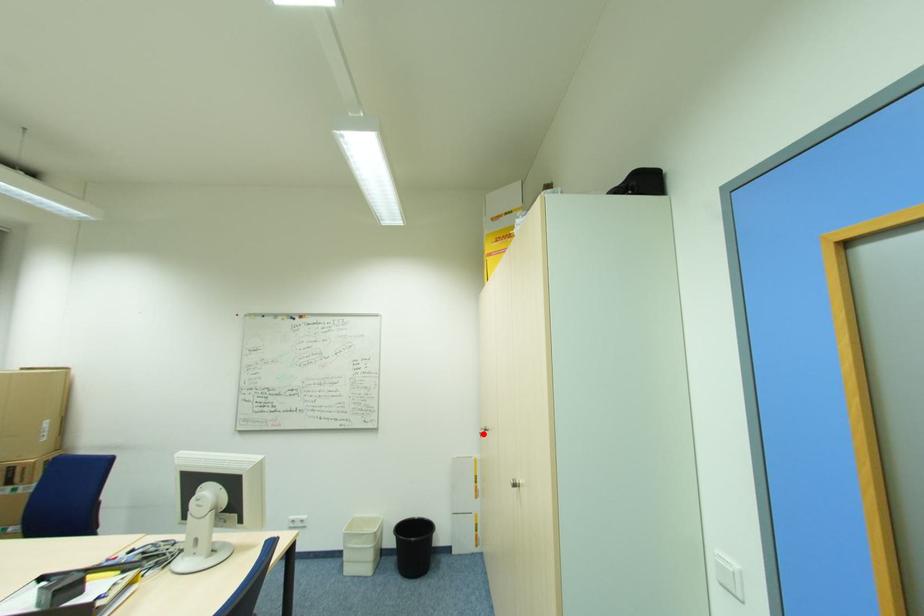
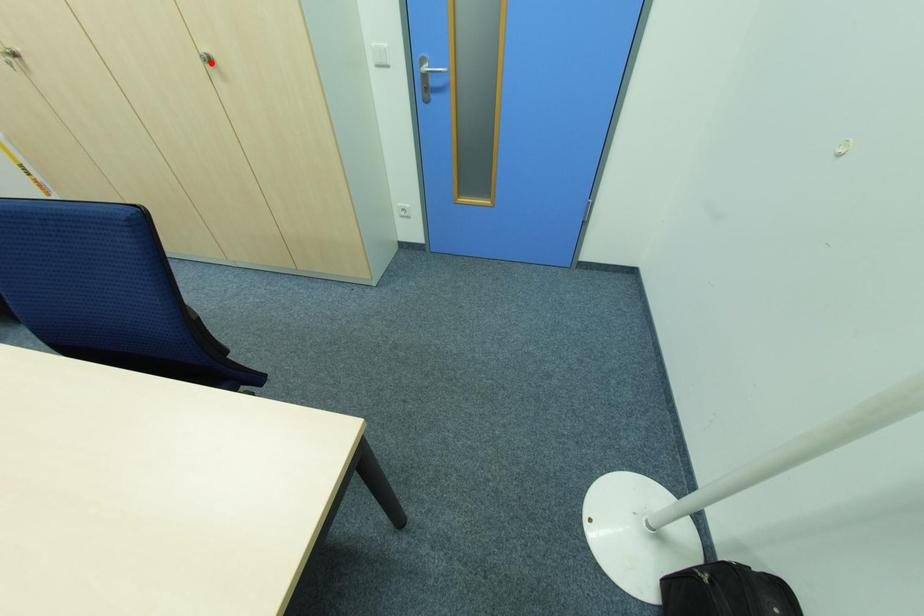
I am providing you with two images of the same scene from different viewpoints. A red point is marked on the first image and another point is marked on the second image. Is the red point in image1 aligned with the point shown in image2?

No